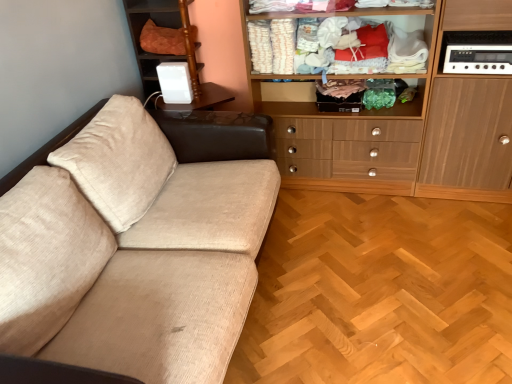
Question: From the image's perspective, is wooden cabinet at upper right, marked as the first cabinetry in a left-to-right arrangement, on orange quilted cushion at upper left?

Choices:
 (A) yes
 (B) no

Answer: (B)

Question: Is wooden cabinet at upper right, marked as the first cabinetry in a left-to-right arrangement, bigger than orange quilted cushion at upper left?

Choices:
 (A) yes
 (B) no

Answer: (A)

Question: Can you see wooden cabinet at upper right, the second cabinetry viewed from the right, touching orange quilted cushion at upper left?

Choices:
 (A) no
 (B) yes

Answer: (A)

Question: From the image's perspective, is wooden cabinet at upper right, marked as the first cabinetry in a left-to-right arrangement, below orange quilted cushion at upper left?

Choices:
 (A) yes
 (B) no

Answer: (A)

Question: Considering the relative sizes of wooden cabinet at upper right, the second cabinetry viewed from the right, and orange quilted cushion at upper left in the image provided, is wooden cabinet at upper right, the second cabinetry viewed from the right, shorter than orange quilted cushion at upper left?

Choices:
 (A) no
 (B) yes

Answer: (A)

Question: From the image's perspective, is light brown wood cabinet at right, the 1th cabinetry in the right-to-left sequence, above or below white plastic device at upper right, which appears as the 1th appliance when viewed from the back?

Choices:
 (A) above
 (B) below

Answer: (B)

Question: From a real-world perspective, is light brown wood cabinet at right, the 1th cabinetry in the right-to-left sequence, above or below white plastic device at upper right, the second appliance viewed from the right?

Choices:
 (A) below
 (B) above

Answer: (A)

Question: Considering the positions of light brown wood cabinet at right, placed as the second cabinetry when sorted from left to right, and white plastic device at upper right, which is counted as the 2th appliance, starting from the front, in the image, is light brown wood cabinet at right, placed as the second cabinetry when sorted from left to right, taller or shorter than white plastic device at upper right, which is counted as the 2th appliance, starting from the front,?

Choices:
 (A) short
 (B) tall

Answer: (B)

Question: Considering the positions of point (424, 144) and point (162, 89), is point (424, 144) closer or farther from the camera than point (162, 89)?

Choices:
 (A) closer
 (B) farther

Answer: (A)

Question: Is white plastic stereo at upper right, marked as the second appliance in a left-to-right arrangement, taller or shorter than wooden cabinet at upper right, marked as the first cabinetry in a left-to-right arrangement?

Choices:
 (A) short
 (B) tall

Answer: (A)

Question: Is white plastic stereo at upper right, the 2th appliance positioned from the back, in front of or behind wooden cabinet at upper right, the second cabinetry viewed from the right, in the image?

Choices:
 (A) behind
 (B) front

Answer: (A)

Question: Considering the positions of point (454, 64) and point (493, 148), is point (454, 64) closer or farther from the camera than point (493, 148)?

Choices:
 (A) closer
 (B) farther

Answer: (A)

Question: Looking at their shapes, would you say white plastic stereo at upper right, the 2th appliance positioned from the back, is wider or thinner than wooden cabinet at upper right, marked as the first cabinetry in a left-to-right arrangement?

Choices:
 (A) wide
 (B) thin

Answer: (B)

Question: Considering the positions of wooden cabinet at upper right, marked as the first cabinetry in a left-to-right arrangement, and white plastic device at upper right, which is the first appliance in left-to-right order, in the image, is wooden cabinet at upper right, marked as the first cabinetry in a left-to-right arrangement, bigger or smaller than white plastic device at upper right, which is the first appliance in left-to-right order,?

Choices:
 (A) small
 (B) big

Answer: (B)

Question: Is wooden cabinet at upper right, the second cabinetry viewed from the right, wider or thinner than white plastic device at upper right, which is the first appliance in left-to-right order?

Choices:
 (A) wide
 (B) thin

Answer: (A)